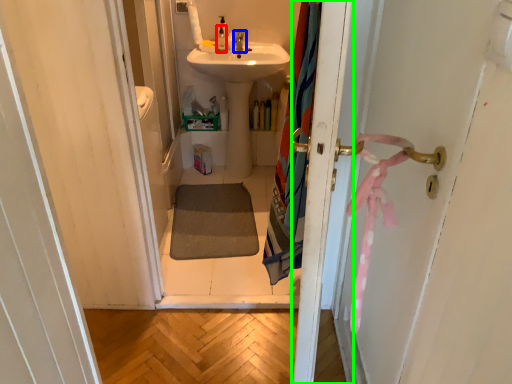
Question: Based on their relative distances, which object is nearer to toiletry (highlighted by a red box)? Choose from tap (highlighted by a blue box) and screen door (highlighted by a green box).

Choices:
 (A) tap
 (B) screen door

Answer: (A)